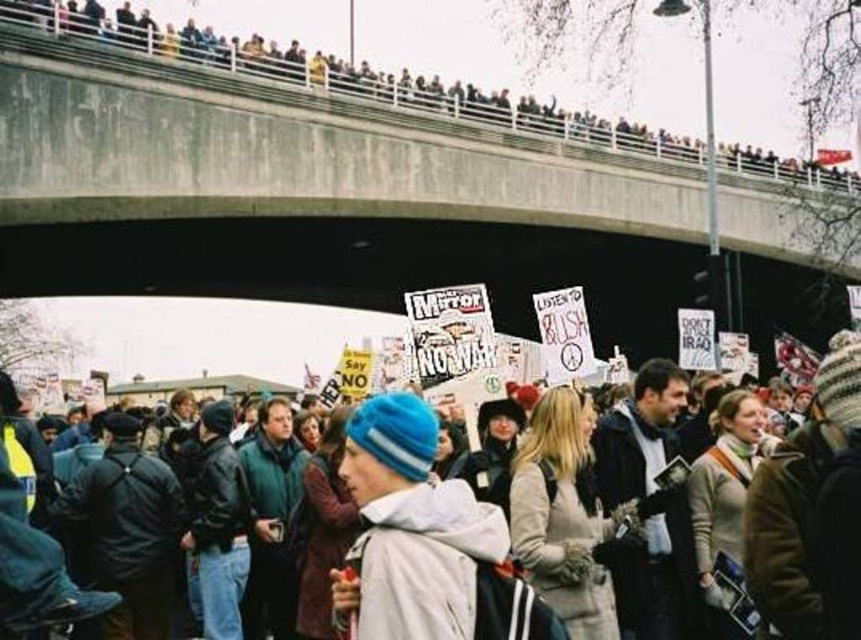
Does concrete bridge at upper center appear over blue knit cap at center?

Indeed, concrete bridge at upper center is positioned over blue knit cap at center.

Can you confirm if concrete bridge at upper center is thinner than blue knit cap at center?

No.

The width and height of the screenshot is (861, 640). I want to click on concrete bridge at upper center, so click(321, 88).